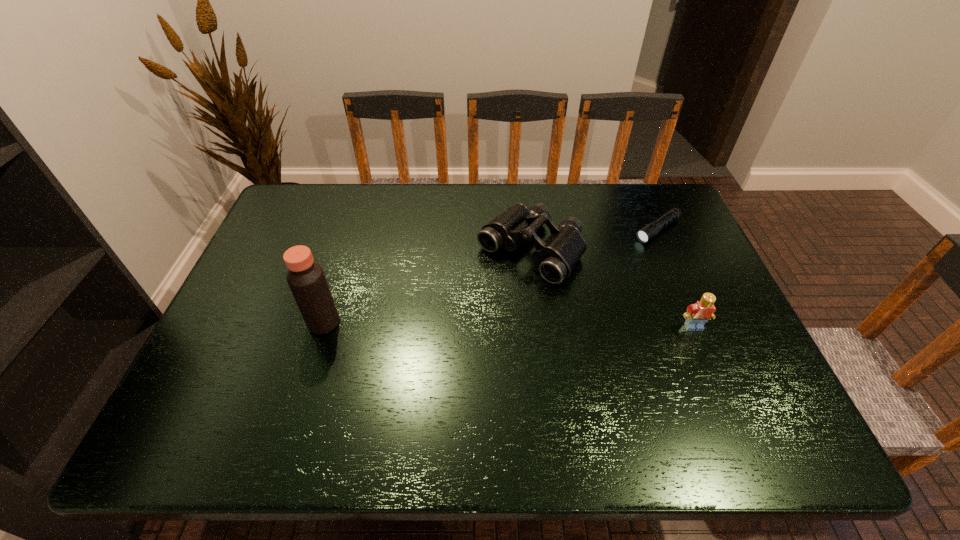
At what (x,y) coordinates should I click in order to perform the action: click on free space on the desktop that is between the tallest object and the Lego and is positioned at the lens end of the flashlight. Please return your answer as a coordinate pair (x, y). The width and height of the screenshot is (960, 540). Looking at the image, I should click on (524, 325).

This screenshot has width=960, height=540. I want to click on free space on the desktop that is between the vinegar and the Lego and is positioned on the front-facing side of the third object from right to left, so click(457, 324).